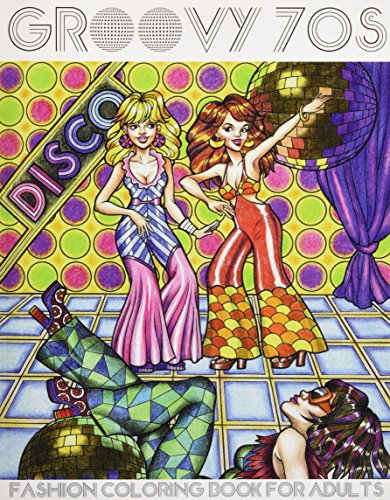
Where is `blue floor`? Image resolution: width=390 pixels, height=500 pixels. blue floor is located at coordinates (20, 390), (109, 324), (242, 394), (365, 331).